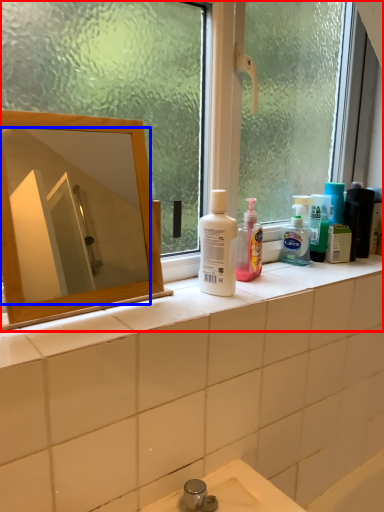
Question: Which object is closer to the camera taking this photo, window (highlighted by a red box) or mirror (highlighted by a blue box)?

Choices:
 (A) window
 (B) mirror

Answer: (A)